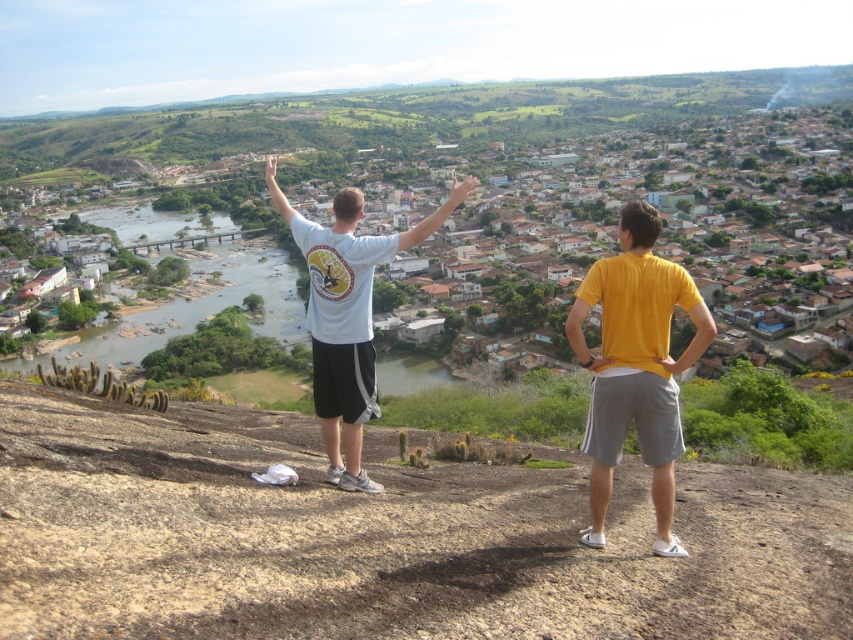
Question: Which of the following is the closest to the observer?

Choices:
 (A) (296, 221)
 (B) (645, 208)

Answer: (B)

Question: Is yellow cotton t-shirt at right to the right of white t-shirt at center from the viewer's perspective?

Choices:
 (A) yes
 (B) no

Answer: (A)

Question: Does yellow cotton t-shirt at right appear on the left side of white t-shirt at center?

Choices:
 (A) no
 (B) yes

Answer: (A)

Question: Which object appears farthest from the camera in this image?

Choices:
 (A) yellow cotton t-shirt at right
 (B) white t-shirt at center

Answer: (B)

Question: Can you confirm if yellow cotton t-shirt at right is bigger than white t-shirt at center?

Choices:
 (A) no
 (B) yes

Answer: (A)